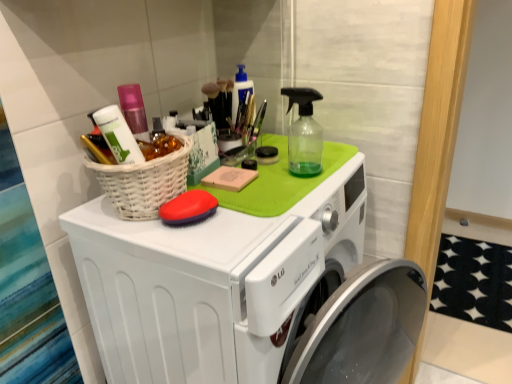
Locate an element on the screen. This screenshot has height=384, width=512. empty space that is to the right of red rubber brush at center is located at coordinates (263, 213).